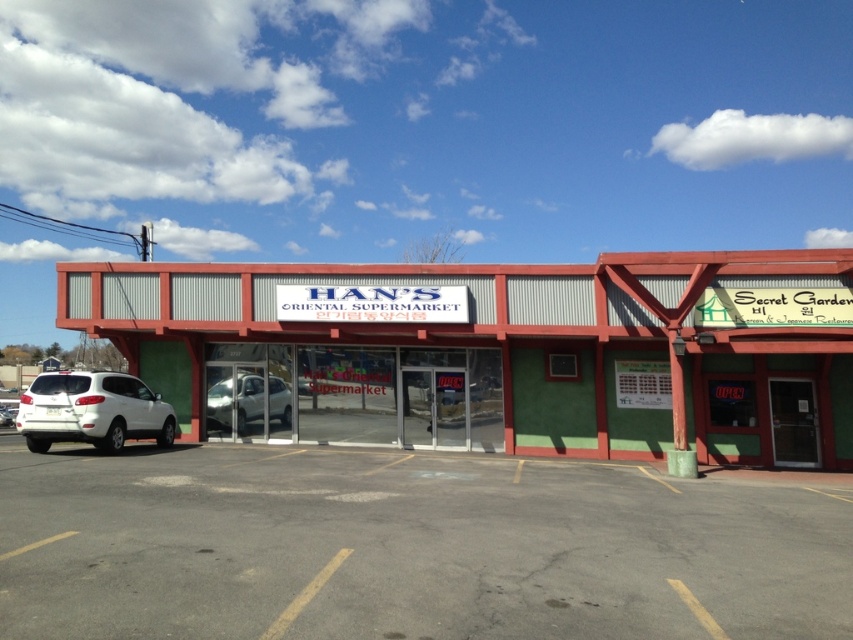
Can you confirm if green corrugated metal building at center is thinner than white matte suv at lower left?

Incorrect, green corrugated metal building at center's width is not less than white matte suv at lower left's.

This screenshot has width=853, height=640. What are the coordinates of `green corrugated metal building at center` in the screenshot? It's located at (505, 349).

Locate an element on the screen. green corrugated metal building at center is located at coordinates (505, 349).

Is gray asphalt parking lot at center to the right of white matte car at center from the viewer's perspective?

Correct, you'll find gray asphalt parking lot at center to the right of white matte car at center.

Between gray asphalt parking lot at center and white matte car at center, which one is positioned higher?

Positioned higher is white matte car at center.

Measure the distance between point (x=672, y=531) and camera.

Point (x=672, y=531) is 8.64 meters away from camera.

This screenshot has width=853, height=640. What are the coordinates of `gray asphalt parking lot at center` in the screenshot? It's located at (409, 547).

Based on the photo, can you confirm if green corrugated metal building at center is thinner than white matte car at center?

No, green corrugated metal building at center is not thinner than white matte car at center.

Does green corrugated metal building at center have a greater width compared to white matte car at center?

Yes, green corrugated metal building at center is wider than white matte car at center.

Locate an element on the screen. green corrugated metal building at center is located at coordinates (505, 349).

Find the location of a particular element. Image resolution: width=853 pixels, height=640 pixels. green corrugated metal building at center is located at coordinates (505, 349).